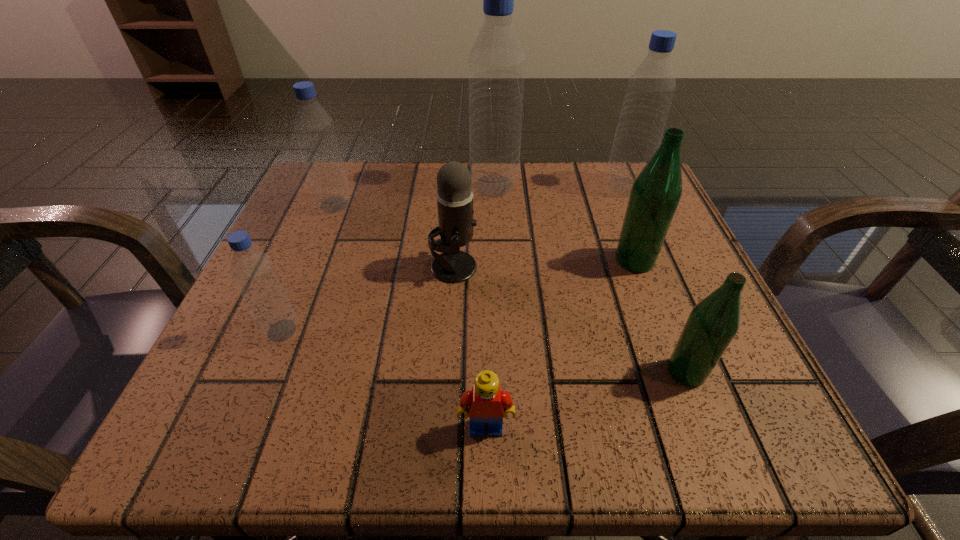
Image resolution: width=960 pixels, height=540 pixels. Identify the location of free region located 0.060m on the back of the second nearest object. (667, 323).

I want to click on bottle that is at the near edge, so click(x=712, y=324).

Locate an element on the screen. This screenshot has width=960, height=540. Lego located in the near edge section of the desktop is located at coordinates (487, 403).

Locate an element on the screen. This screenshot has height=540, width=960. object that is at the far left corner is located at coordinates tap(314, 128).

Image resolution: width=960 pixels, height=540 pixels. What are the coordinates of `object located in the far right corner section of the desktop` in the screenshot? It's located at (649, 93).

Locate an element on the screen. object located in the near right corner section of the desktop is located at coordinates coord(712,324).

Identify the location of vacant space at the far edge. (540, 166).

Identify the location of vacant space at the near edge. The width and height of the screenshot is (960, 540). (408, 433).

The height and width of the screenshot is (540, 960). Identify the location of vacant area at the left edge. (277, 355).

Image resolution: width=960 pixels, height=540 pixels. Find the location of `free space at the right edge`. free space at the right edge is located at coordinates (641, 317).